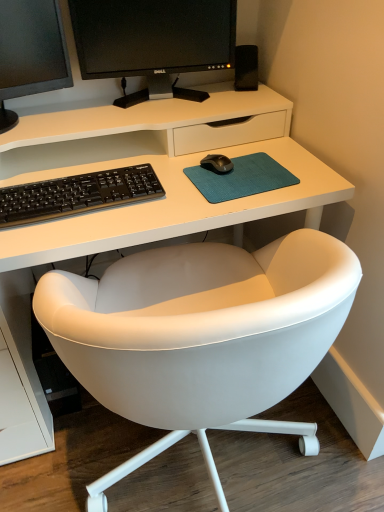
Question: Is black glossy monitor at upper left, the first computer monitor in the left-to-right sequence, facing towards black matte speaker at upper right?

Choices:
 (A) yes
 (B) no

Answer: (B)

Question: Is black glossy monitor at upper left, the first computer monitor in the left-to-right sequence, bigger than black matte speaker at upper right?

Choices:
 (A) yes
 (B) no

Answer: (A)

Question: Does black glossy monitor at upper left, which is counted as the second computer monitor, starting from the right, come in front of black matte speaker at upper right?

Choices:
 (A) yes
 (B) no

Answer: (A)

Question: From a real-world perspective, is black glossy monitor at upper left, the first computer monitor in the left-to-right sequence, on black matte speaker at upper right?

Choices:
 (A) yes
 (B) no

Answer: (A)

Question: Considering the relative sizes of black glossy monitor at upper left, which is counted as the second computer monitor, starting from the right, and black matte speaker at upper right in the image provided, is black glossy monitor at upper left, which is counted as the second computer monitor, starting from the right, thinner than black matte speaker at upper right?

Choices:
 (A) no
 (B) yes

Answer: (A)

Question: Considering the relative sizes of black glossy monitor at upper left, which is counted as the second computer monitor, starting from the right, and black matte speaker at upper right in the image provided, is black glossy monitor at upper left, which is counted as the second computer monitor, starting from the right, smaller than black matte speaker at upper right?

Choices:
 (A) no
 (B) yes

Answer: (A)

Question: Would you consider teal fabric mousepad at center to be distant from black glossy monitor at upper center, arranged as the 2th computer monitor when viewed from the left?

Choices:
 (A) no
 (B) yes

Answer: (A)

Question: Is teal fabric mousepad at center turned away from black glossy monitor at upper center, arranged as the 2th computer monitor when viewed from the left?

Choices:
 (A) yes
 (B) no

Answer: (B)

Question: Can you confirm if teal fabric mousepad at center is positioned to the left of black glossy monitor at upper center, arranged as the 2th computer monitor when viewed from the left?

Choices:
 (A) yes
 (B) no

Answer: (B)

Question: Is teal fabric mousepad at center behind black glossy monitor at upper center, arranged as the 2th computer monitor when viewed from the left?

Choices:
 (A) yes
 (B) no

Answer: (B)

Question: Does teal fabric mousepad at center have a larger size compared to black glossy monitor at upper center, marked as the 1th computer monitor in a right-to-left arrangement?

Choices:
 (A) no
 (B) yes

Answer: (A)

Question: Does teal fabric mousepad at center have a greater width compared to black glossy monitor at upper center, arranged as the 2th computer monitor when viewed from the left?

Choices:
 (A) yes
 (B) no

Answer: (A)

Question: Would you say black glossy monitor at upper left, the first computer monitor in the left-to-right sequence, is part of black glossy monitor at upper center, marked as the 1th computer monitor in a right-to-left arrangement,'s contents?

Choices:
 (A) no
 (B) yes

Answer: (A)